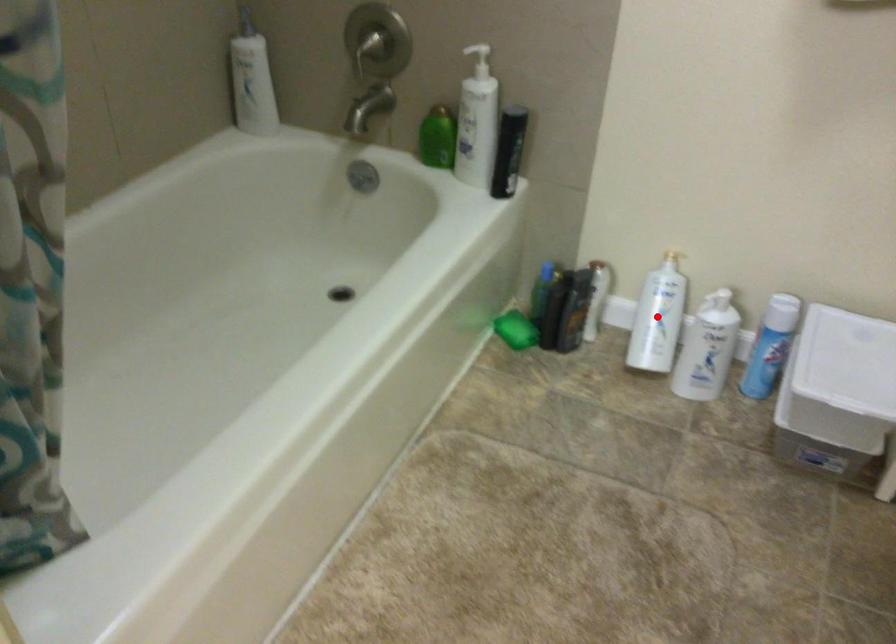
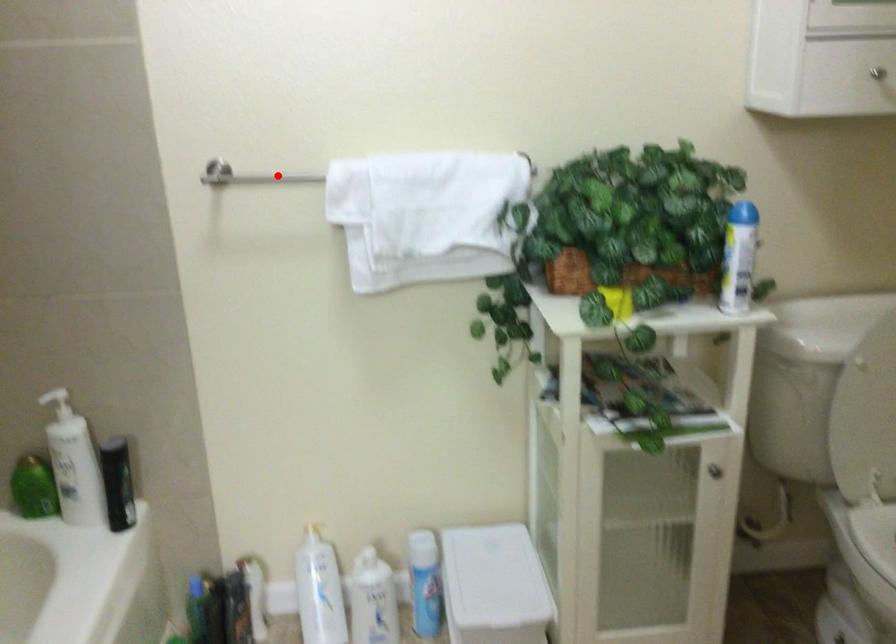
Consider the image. I am providing you with two images of the same scene from different viewpoints. A red point is marked on the first image and another point is marked on the second image. Is the red point in image1 aligned with the point shown in image2?

No